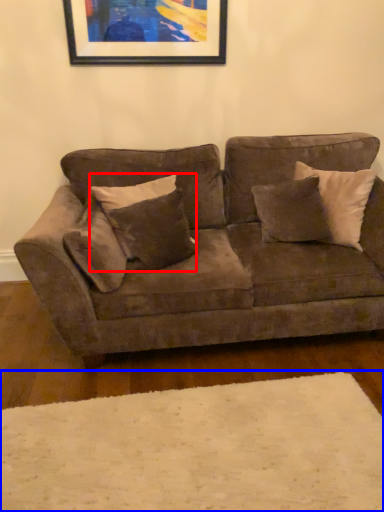
Question: Which point is further to the camera, pillow (highlighted by a red box) or plain (highlighted by a blue box)?

Choices:
 (A) pillow
 (B) plain

Answer: (A)